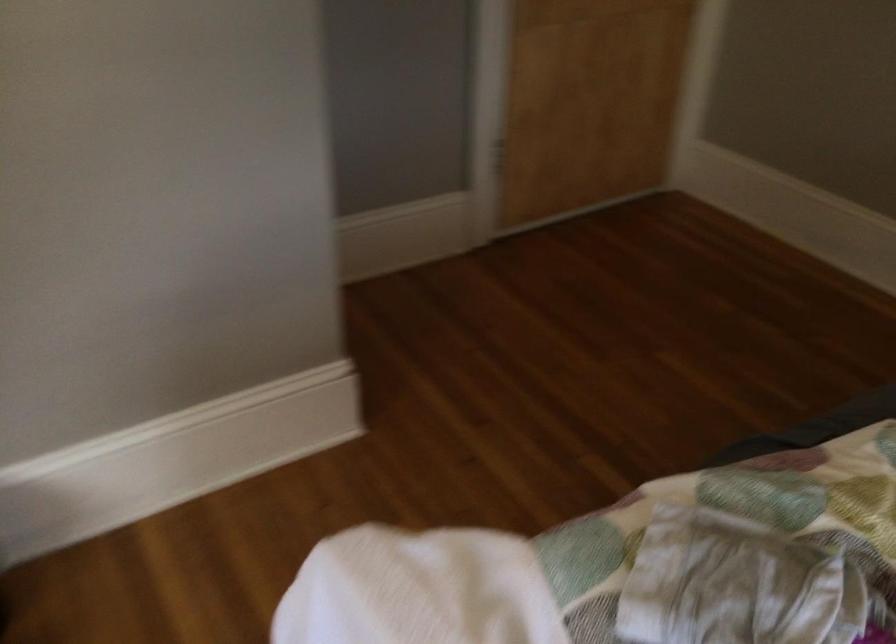
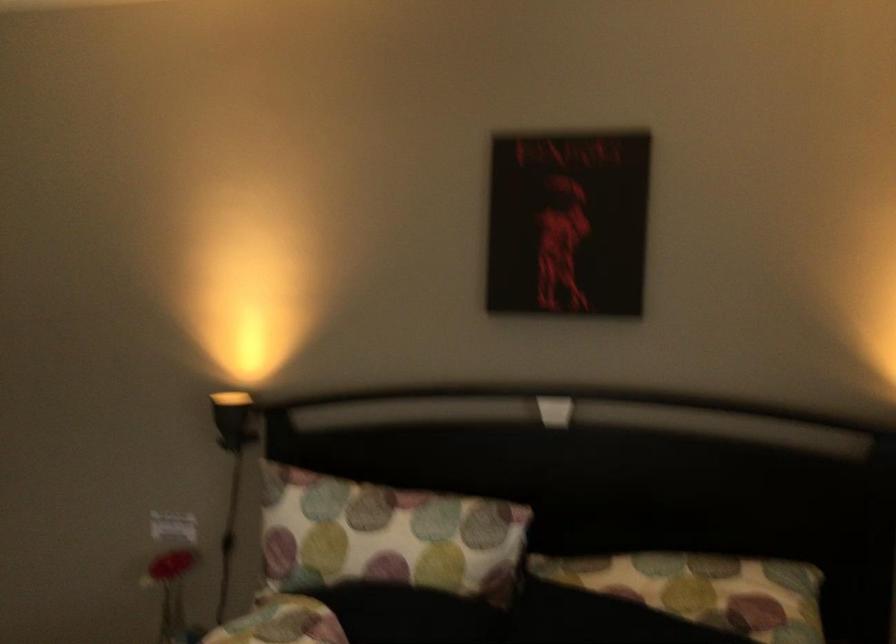
How did the camera likely rotate?

The rotation direction of the camera is right-up.